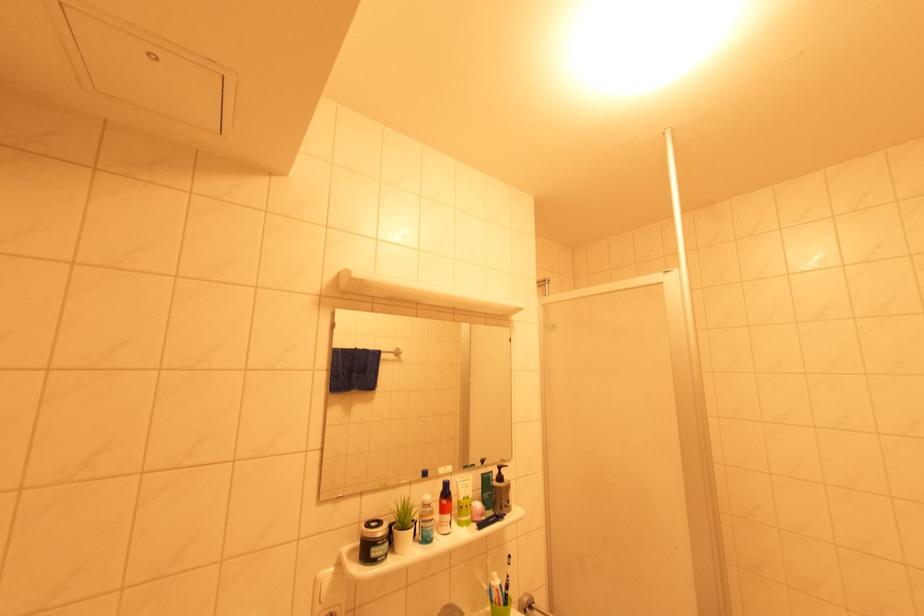
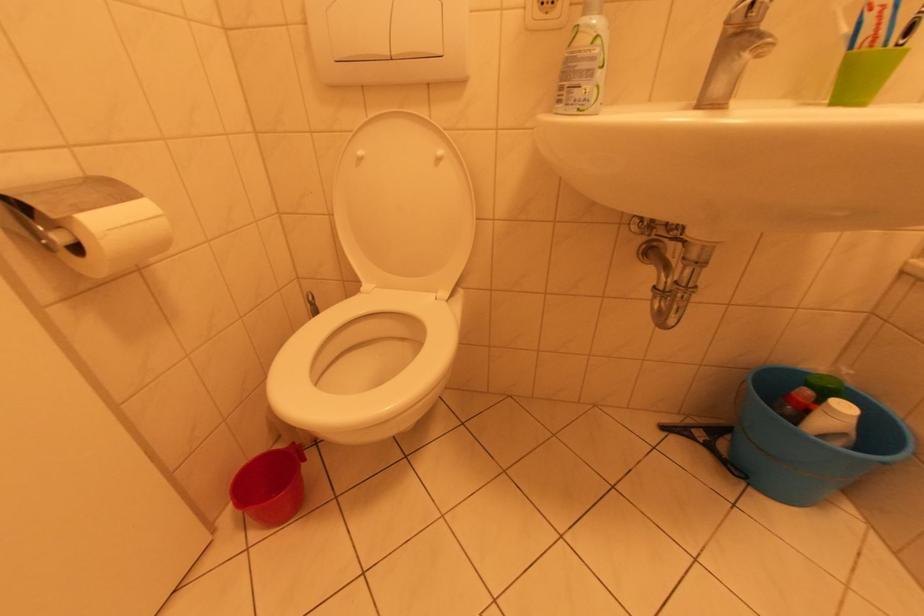
Based on the continuous images, in which direction is the camera rotating?

The rotation direction of the camera is left-down.